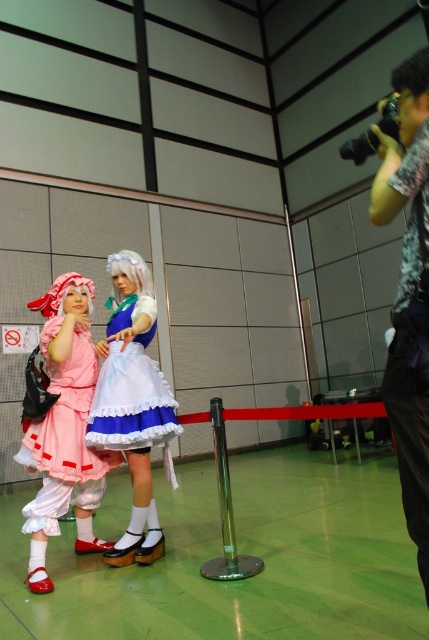
You are a photographer at the event and need to position a spotlight exactly at the center of the matte blue dress at center. According to the coordinates provided, where should you aim the spotlight?

The spotlight should be aimed at the coordinates point [132,404], as that is the 2D location of the matte blue dress at center.

You are a photographer at the event and need to position the matte blue dress at center and the white silky wig at center for a group photo. Which object should be placed to the left to ensure they are aligned correctly according to their current positions?

The white silky wig at center should be placed to the left because the matte blue dress at center is currently on the right side of the white silky wig at center.